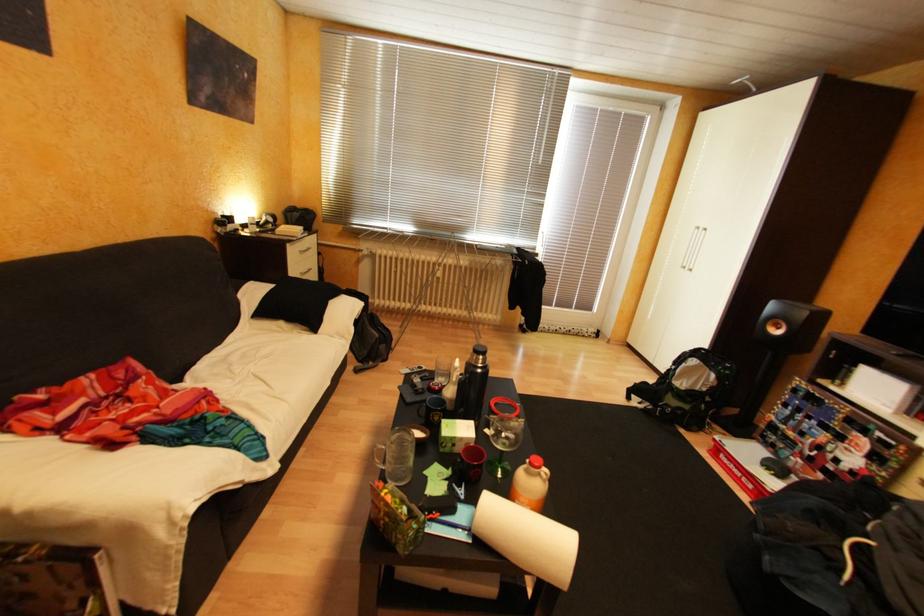
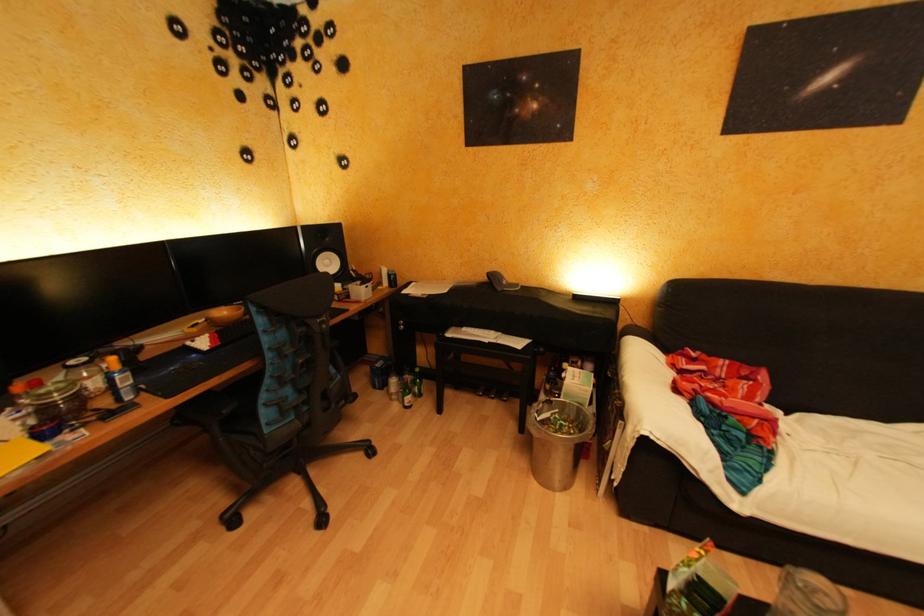
The images are taken continuously from a first-person perspective. In which direction is your viewpoint rotating?

The camera rotated toward left-down.